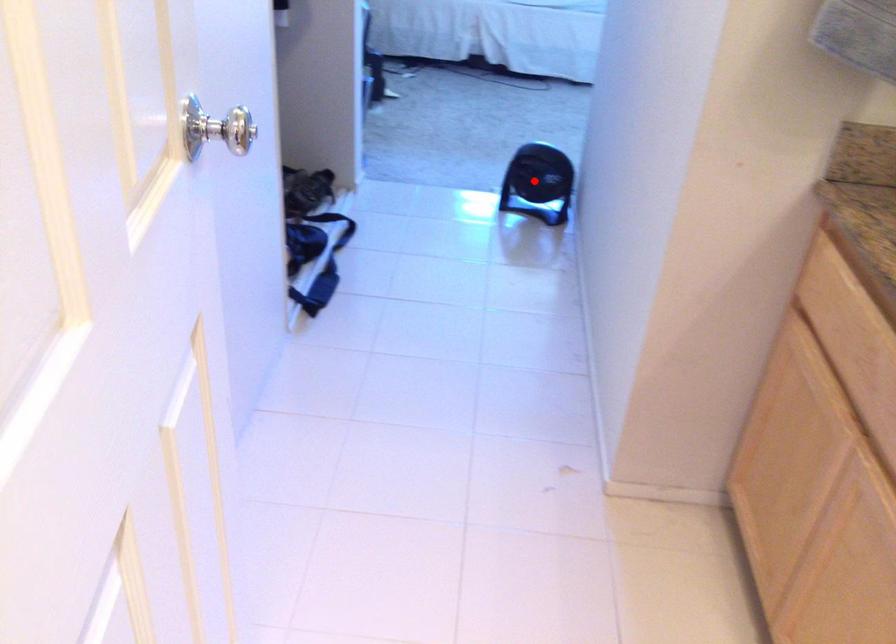
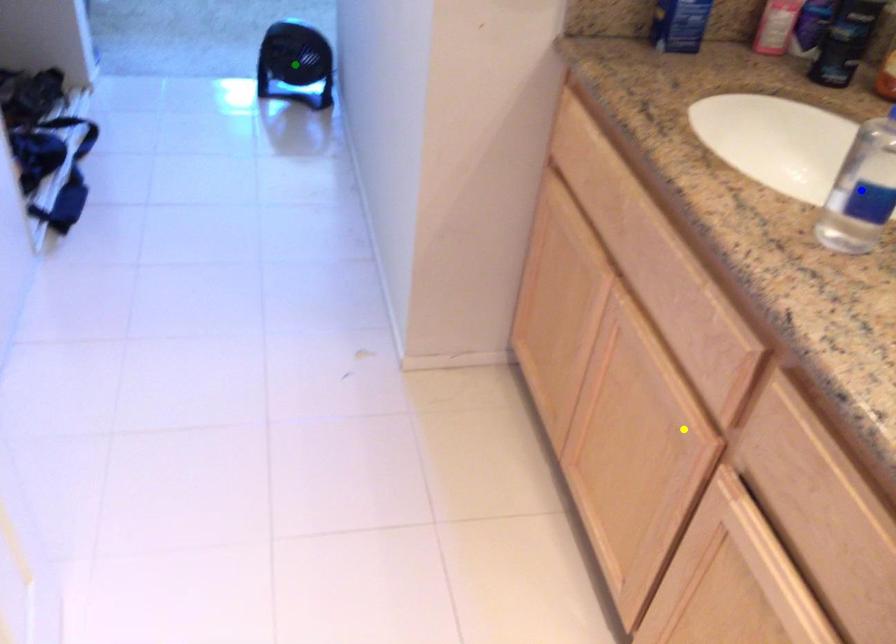
Question: I am providing you with two images of the same scene from different viewpoints. A red point is marked on the first image. You are given multiple points on the second image. Which point in image 2 represents the same 3d spot as the red point in image 1?

Choices:
 (A) yellow point
 (B) blue point
 (C) green point

Answer: (C)